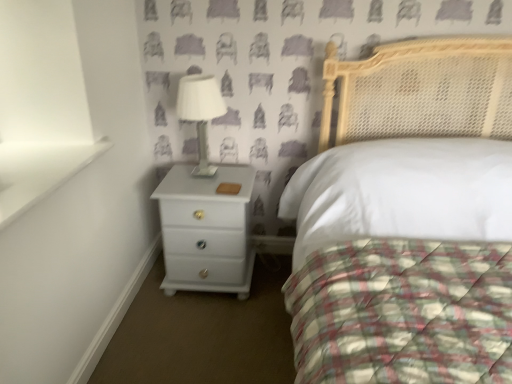
What are the coordinates of `vacant space situated above white glossy chest of drawers at lower left (from a real-world perspective)` in the screenshot? It's located at (197, 180).